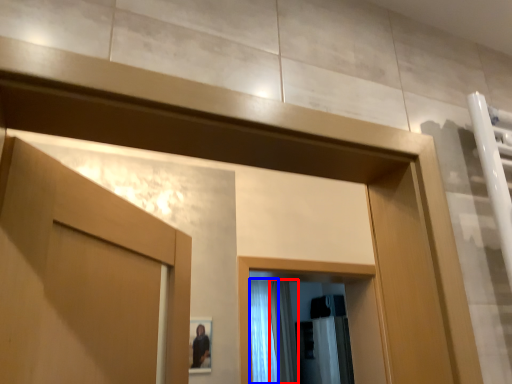
Question: Which object is closer to the camera taking this photo, shower curtain (highlighted by a red box) or shower curtain (highlighted by a blue box)?

Choices:
 (A) shower curtain
 (B) shower curtain

Answer: (B)